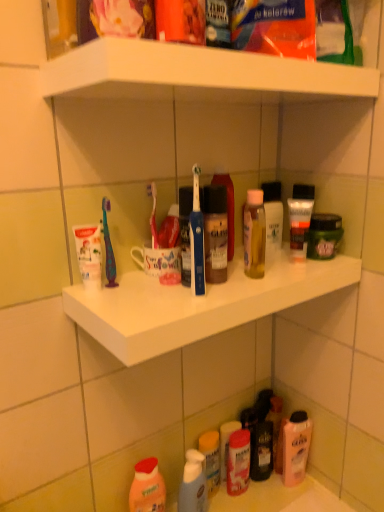
The image size is (384, 512). In order to click on unoccupied region to the right of white matte toothpaste at left in this screenshot , I will do (162, 295).